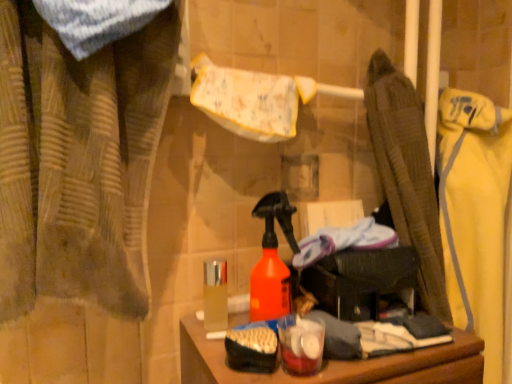
Question: Is brown textured curtain at left spatially inside white/yellow fabric towel at upper center, or outside of it?

Choices:
 (A) outside
 (B) inside

Answer: (A)

Question: In terms of size, does brown textured curtain at left appear bigger or smaller than white/yellow fabric towel at upper center?

Choices:
 (A) small
 (B) big

Answer: (B)

Question: Considering the real-world distances, which object is closest to the shiny metallic container at center?

Choices:
 (A) white/yellow fabric towel at upper center
 (B) yellow fabric jacket at right
 (C) brown textured curtain at left

Answer: (A)

Question: Which object is the closest to the yellow fabric jacket at right?

Choices:
 (A) white/yellow fabric towel at upper center
 (B) shiny metallic container at center
 (C) brown textured curtain at left

Answer: (A)